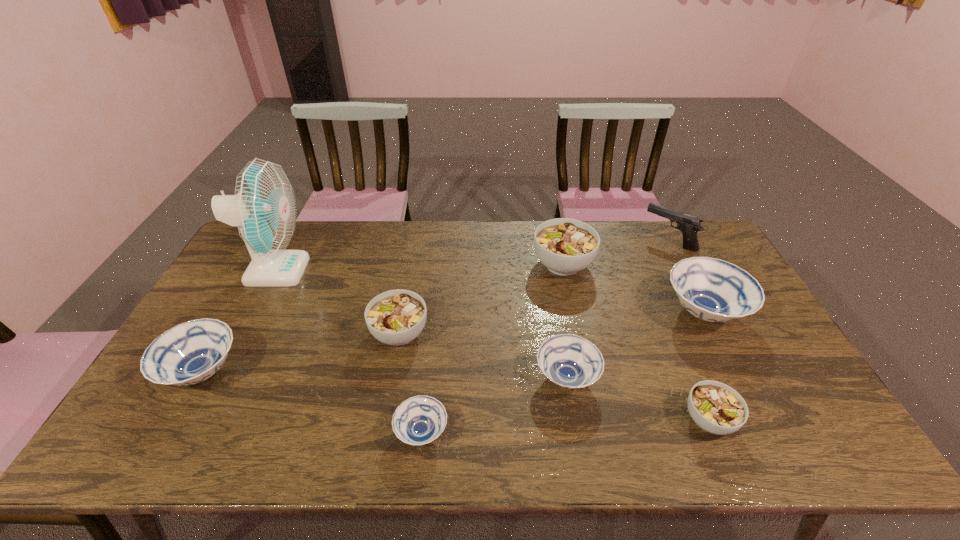
What are the coordinates of `the third blue soup bowl from left to right` in the screenshot? It's located at (569, 361).

The height and width of the screenshot is (540, 960). Find the location of `the nearest white soup bowl`. the nearest white soup bowl is located at coordinates (717, 408).

The height and width of the screenshot is (540, 960). I want to click on the smallest white soup bowl, so click(717, 408).

At what (x,y) coordinates should I click in order to perform the action: click on the smallest blue soup bowl. Please return your answer as a coordinate pair (x, y). Image resolution: width=960 pixels, height=540 pixels. Looking at the image, I should click on (419, 420).

In order to click on the nearest blue soup bowl in this screenshot , I will do `click(419, 420)`.

Identify the location of vacant space located 0.310m in front of the fan to face the airflow. Image resolution: width=960 pixels, height=540 pixels. (398, 271).

In order to click on free space located 0.250m at the muzzle of the black gun in this screenshot , I will do `click(575, 241)`.

Where is `free region located 0.090m at the muzzle of the black gun`? This screenshot has height=540, width=960. free region located 0.090m at the muzzle of the black gun is located at coordinates (619, 241).

Find the location of `free space located at the muzzle of the black gun`. free space located at the muzzle of the black gun is located at coordinates (628, 241).

Where is `vacant area situated 0.400m on the front of the farthest white soup bowl`? The width and height of the screenshot is (960, 540). vacant area situated 0.400m on the front of the farthest white soup bowl is located at coordinates (590, 393).